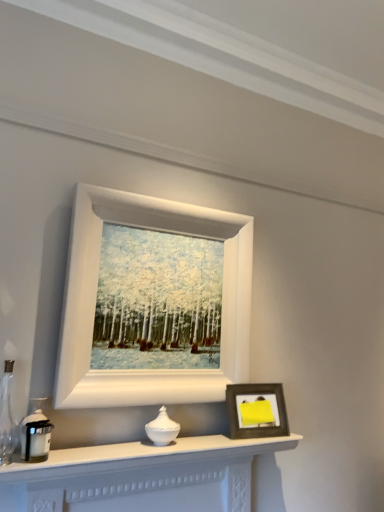
Question: Could you tell me if wooden photo frame at lower right, the first picture frame in the bottom-to-top sequence, is facing white matte picture frame at upper center, arranged as the 1th picture frame when viewed from the top?

Choices:
 (A) no
 (B) yes

Answer: (A)

Question: From a real-world perspective, is wooden photo frame at lower right, which is counted as the second picture frame, starting from the top, below white matte picture frame at upper center, placed as the 2th picture frame when sorted from bottom to top?

Choices:
 (A) yes
 (B) no

Answer: (A)

Question: From a real-world perspective, is wooden photo frame at lower right, the first picture frame in the bottom-to-top sequence, on top of white matte picture frame at upper center, placed as the 2th picture frame when sorted from bottom to top?

Choices:
 (A) yes
 (B) no

Answer: (B)

Question: From the image's perspective, is wooden photo frame at lower right, which is counted as the second picture frame, starting from the top, located beneath white matte picture frame at upper center, arranged as the 1th picture frame when viewed from the top?

Choices:
 (A) yes
 (B) no

Answer: (A)

Question: Does wooden photo frame at lower right, the first picture frame in the bottom-to-top sequence, have a lesser height compared to white matte picture frame at upper center, placed as the 2th picture frame when sorted from bottom to top?

Choices:
 (A) no
 (B) yes

Answer: (B)

Question: Can white matte picture frame at upper center, placed as the 2th picture frame when sorted from bottom to top, be found inside wooden photo frame at lower right, which is counted as the second picture frame, starting from the top?

Choices:
 (A) no
 (B) yes

Answer: (A)

Question: Is wooden photo frame at lower right, the first picture frame in the bottom-to-top sequence, at the right side of white matte fireplace at lower center?

Choices:
 (A) no
 (B) yes

Answer: (B)

Question: Does wooden photo frame at lower right, the first picture frame in the bottom-to-top sequence, have a larger size compared to white matte fireplace at lower center?

Choices:
 (A) no
 (B) yes

Answer: (A)

Question: Can you confirm if wooden photo frame at lower right, which is counted as the second picture frame, starting from the top, is thinner than white matte fireplace at lower center?

Choices:
 (A) yes
 (B) no

Answer: (A)

Question: Is wooden photo frame at lower right, which is counted as the second picture frame, starting from the top, positioned with its back to white matte fireplace at lower center?

Choices:
 (A) no
 (B) yes

Answer: (A)

Question: From a real-world perspective, is wooden photo frame at lower right, the first picture frame in the bottom-to-top sequence, physically above white matte fireplace at lower center?

Choices:
 (A) yes
 (B) no

Answer: (A)

Question: Does wooden photo frame at lower right, the first picture frame in the bottom-to-top sequence, come in front of white matte fireplace at lower center?

Choices:
 (A) yes
 (B) no

Answer: (B)

Question: Considering the relative positions of matte black candle holder at left, which is the first candle holder in front-to-back order, and wooden photo frame at lower right, which is counted as the second picture frame, starting from the top, in the image provided, is matte black candle holder at left, which is the first candle holder in front-to-back order, in front of wooden photo frame at lower right, which is counted as the second picture frame, starting from the top,?

Choices:
 (A) no
 (B) yes

Answer: (B)